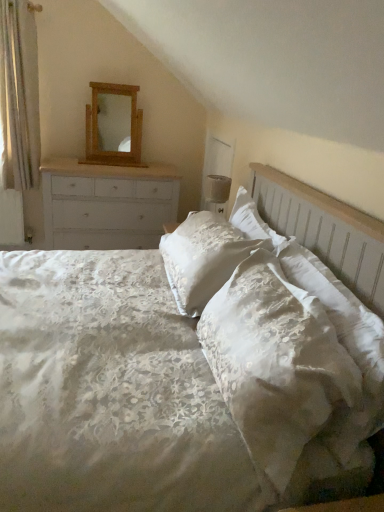
Question: From a real-world perspective, does wooden mirror at upper center stand above white painted wood chest of drawers at left?

Choices:
 (A) yes
 (B) no

Answer: (A)

Question: Can you confirm if wooden mirror at upper center is bigger than white painted wood chest of drawers at left?

Choices:
 (A) yes
 (B) no

Answer: (B)

Question: Does wooden mirror at upper center come behind white painted wood chest of drawers at left?

Choices:
 (A) no
 (B) yes

Answer: (B)

Question: Is wooden mirror at upper center positioned far away from white painted wood chest of drawers at left?

Choices:
 (A) yes
 (B) no

Answer: (B)

Question: Is wooden mirror at upper center not within white painted wood chest of drawers at left?

Choices:
 (A) no
 (B) yes

Answer: (B)

Question: Is point (215, 200) closer or farther from the camera than point (117, 229)?

Choices:
 (A) closer
 (B) farther

Answer: (A)

Question: Based on their sizes in the image, would you say matte white lampshade at upper right is bigger or smaller than white painted wood chest of drawers at left?

Choices:
 (A) small
 (B) big

Answer: (A)

Question: Is matte white lampshade at upper right to the left or to the right of white painted wood chest of drawers at left in the image?

Choices:
 (A) left
 (B) right

Answer: (B)

Question: From the image's perspective, is matte white lampshade at upper right positioned above or below white painted wood chest of drawers at left?

Choices:
 (A) above
 (B) below

Answer: (A)

Question: From a real-world perspective, is white satin pillow at center above or below linen bed at center?

Choices:
 (A) above
 (B) below

Answer: (A)

Question: From the image's perspective, relative to linen bed at center, is white satin pillow at center above or below?

Choices:
 (A) below
 (B) above

Answer: (B)

Question: Based on their sizes in the image, would you say white satin pillow at center is bigger or smaller than linen bed at center?

Choices:
 (A) big
 (B) small

Answer: (B)

Question: Which is correct: white satin pillow at center is inside linen bed at center, or outside of it?

Choices:
 (A) inside
 (B) outside

Answer: (A)

Question: From the image's perspective, relative to matte white lampshade at upper right, is wooden mirror at upper center above or below?

Choices:
 (A) above
 (B) below

Answer: (A)

Question: In terms of width, does wooden mirror at upper center look wider or thinner when compared to matte white lampshade at upper right?

Choices:
 (A) thin
 (B) wide

Answer: (A)